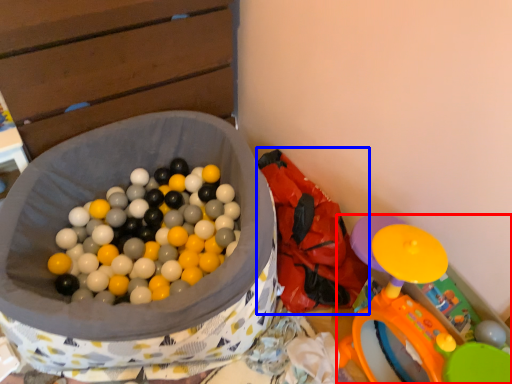
Question: Which object appears farthest to the camera in this image, toy (highlighted by a red box) or bean bag chair (highlighted by a blue box)?

Choices:
 (A) toy
 (B) bean bag chair

Answer: (B)